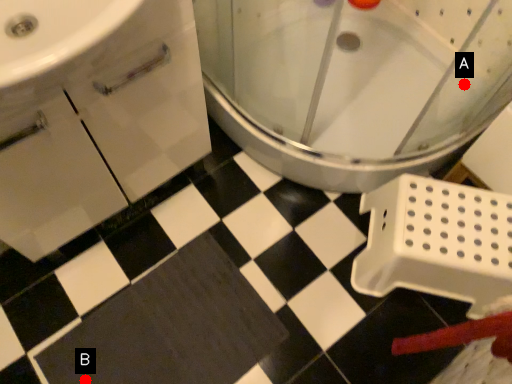
Question: Two points are circled on the image, labeled by A and B beside each circle. Among these points, which one is farthest from the camera?

Choices:
 (A) A is further
 (B) B is further

Answer: (A)